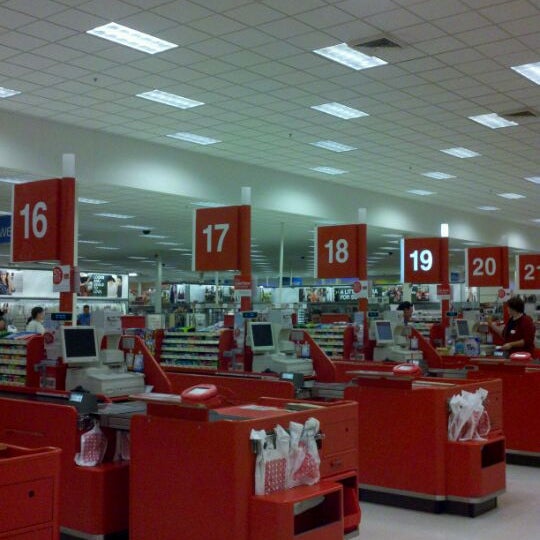
This screenshot has height=540, width=540. In order to click on red counter in this screenshot , I will do `click(265, 414)`.